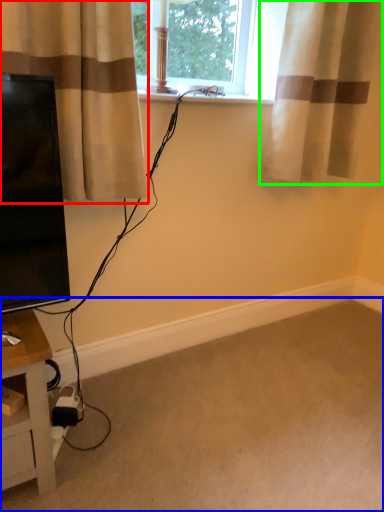
Question: Based on their relative distances, which object is nearer to curtain (highlighted by a red box)? Choose from plain (highlighted by a blue box) and curtain (highlighted by a green box).

Choices:
 (A) plain
 (B) curtain

Answer: (B)